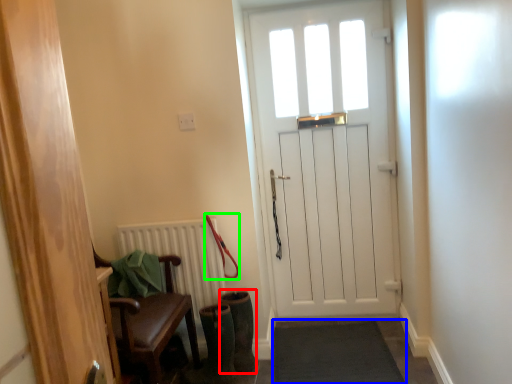
Question: Based on their relative distances, which object is farther from boot (highlighted by a red box)? Choose from doormat (highlighted by a blue box) and leash (highlighted by a green box).

Choices:
 (A) doormat
 (B) leash

Answer: (A)